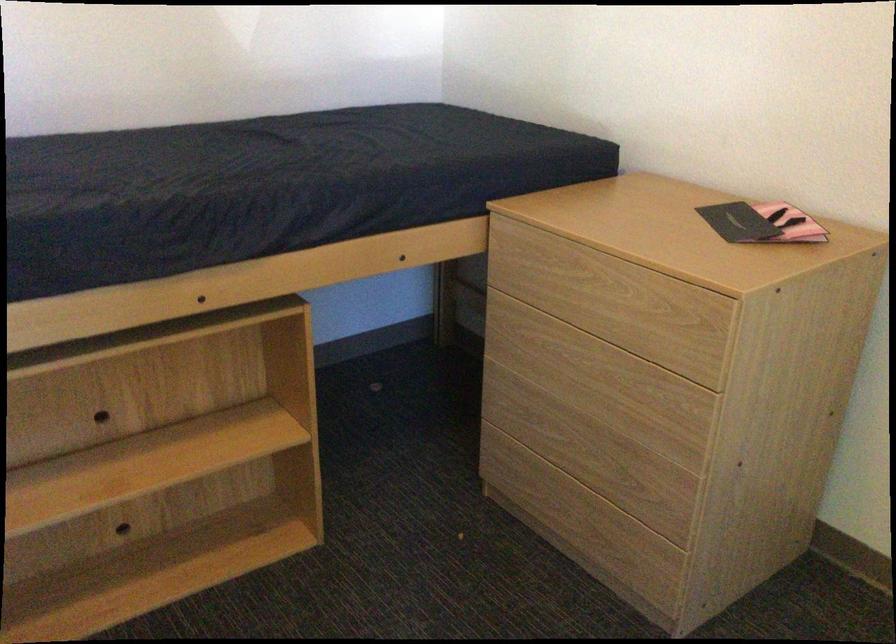
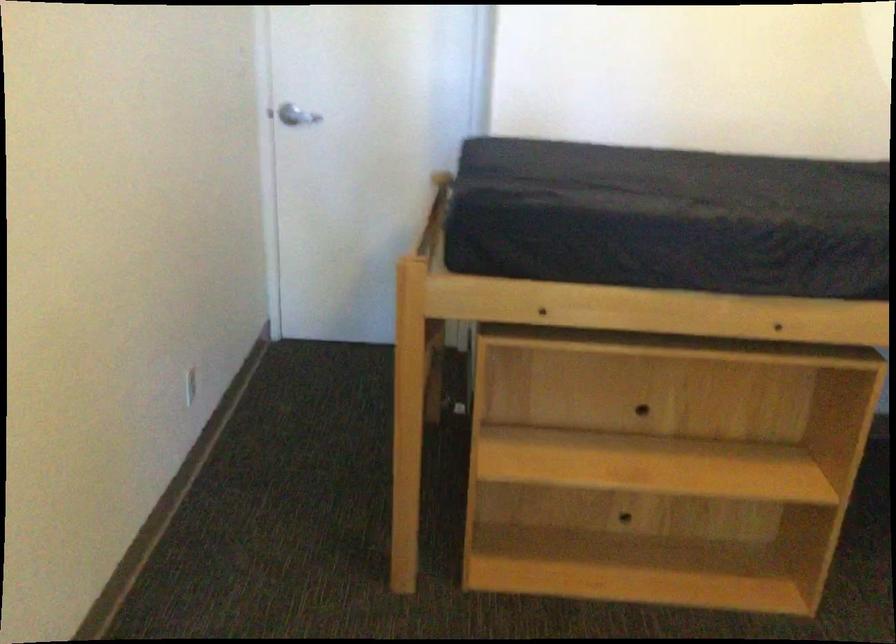
Question: The first image is from the beginning of the video and the second image is from the end. How did the camera likely rotate when shooting the video?

Choices:
 (A) Left
 (B) Right
 (C) Up
 (D) Down

Answer: (A)